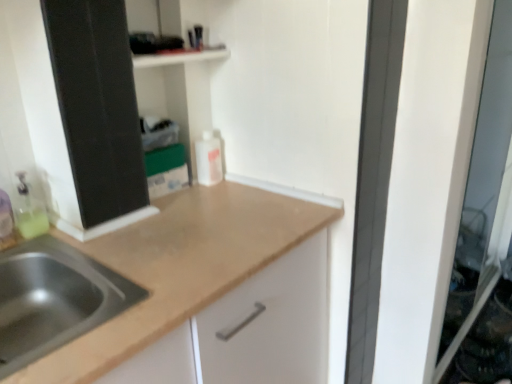
Question: Would you consider stainless steel sink at lower left to be distant from transparent glass screen door at right?

Choices:
 (A) yes
 (B) no

Answer: (A)

Question: Is stainless steel sink at lower left further to camera compared to transparent glass screen door at right?

Choices:
 (A) yes
 (B) no

Answer: (B)

Question: Is stainless steel sink at lower left taller than transparent glass screen door at right?

Choices:
 (A) yes
 (B) no

Answer: (B)

Question: Is transparent glass screen door at right at the back of stainless steel sink at lower left?

Choices:
 (A) no
 (B) yes

Answer: (A)

Question: Does stainless steel sink at lower left have a lesser width compared to transparent glass screen door at right?

Choices:
 (A) no
 (B) yes

Answer: (A)

Question: From a real-world perspective, is stainless steel sink at lower left located beneath transparent glass screen door at right?

Choices:
 (A) no
 (B) yes

Answer: (A)

Question: Is transparent glass screen door at right at the left side of translucent plastic bottle at left?

Choices:
 (A) no
 (B) yes

Answer: (A)

Question: Is translucent plastic bottle at left at the back of transparent glass screen door at right?

Choices:
 (A) yes
 (B) no

Answer: (B)

Question: Can you confirm if transparent glass screen door at right is taller than translucent plastic bottle at left?

Choices:
 (A) yes
 (B) no

Answer: (A)

Question: From a real-world perspective, is transparent glass screen door at right under translucent plastic bottle at left?

Choices:
 (A) yes
 (B) no

Answer: (A)

Question: Is transparent glass screen door at right shorter than translucent plastic bottle at left?

Choices:
 (A) no
 (B) yes

Answer: (A)

Question: From the image's perspective, is transparent glass screen door at right located above translucent plastic bottle at left?

Choices:
 (A) no
 (B) yes

Answer: (B)

Question: Is the position of white matte bottle at center less distant than that of transparent glass screen door at right?

Choices:
 (A) yes
 (B) no

Answer: (B)